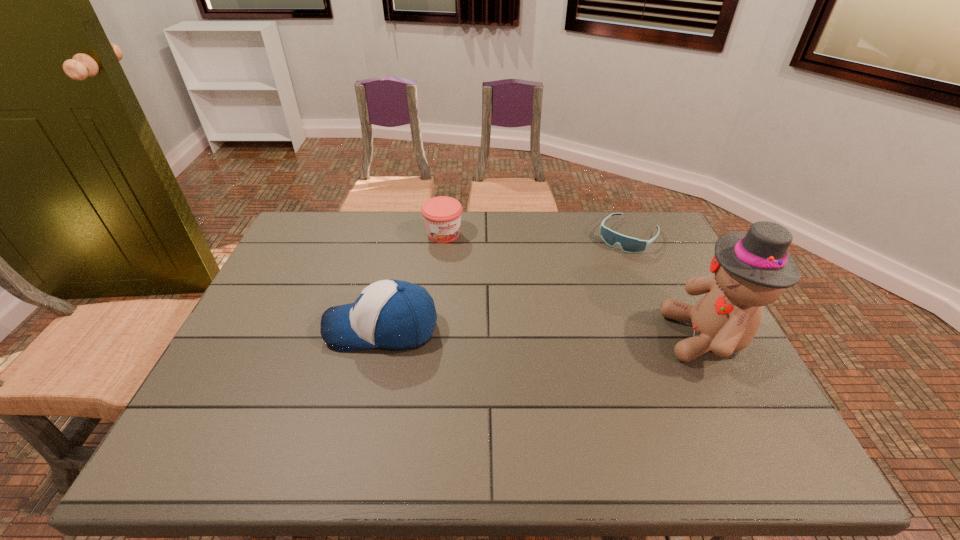
Locate an element on the screen. The height and width of the screenshot is (540, 960). vacant space located on the front-facing side of the shortest object is located at coordinates (595, 276).

Locate an element on the screen. Image resolution: width=960 pixels, height=540 pixels. vacant space located on the front-facing side of the shortest object is located at coordinates (566, 311).

Identify the location of vacant space situated on the front-facing side of the shortest object. The width and height of the screenshot is (960, 540). (595, 276).

The width and height of the screenshot is (960, 540). Find the location of `vacant area located 0.110m on the front label of the jam`. vacant area located 0.110m on the front label of the jam is located at coordinates (466, 264).

Identify the location of vacant region located on the front label of the jam. The image size is (960, 540). tap(500, 313).

At what (x,y) coordinates should I click in order to perform the action: click on vacant space located 0.060m on the front label of the jam. Please return your answer as a coordinate pair (x, y). Looking at the image, I should click on (459, 255).

Image resolution: width=960 pixels, height=540 pixels. Identify the location of goggles that is at the far edge. (628, 244).

What are the coordinates of `jam present at the far edge` in the screenshot? It's located at (442, 215).

At what (x,y) coordinates should I click in order to perform the action: click on rag_doll located at the right edge. Please return your answer as a coordinate pair (x, y). The image size is (960, 540). Looking at the image, I should click on (751, 269).

At what (x,y) coordinates should I click in order to perform the action: click on goggles located in the right edge section of the desktop. Please return your answer as a coordinate pair (x, y). This screenshot has height=540, width=960. Looking at the image, I should click on (628, 244).